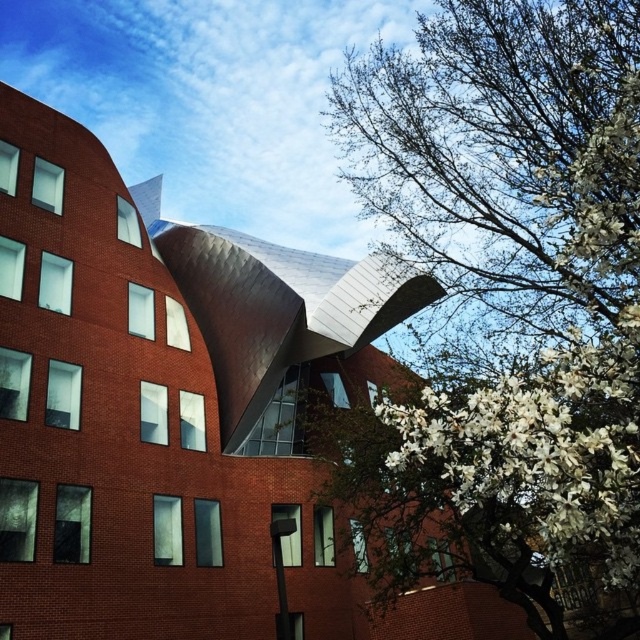
Who is more forward, (432, 422) or (499, 476)?

Positioned in front is point (499, 476).

Who is lower down, white blossoms at upper right or white fluffy petals at right?

white fluffy petals at right is lower down.

Is point (628, 186) behind point (586, 356)?

Yes, point (628, 186) is behind point (586, 356).

Locate an element on the screen. white blossoms at upper right is located at coordinates (506, 304).